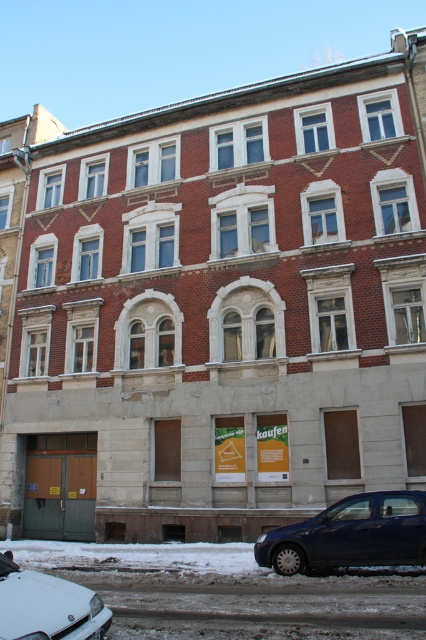
Based on the photo, you are a delivery person with a cart that is 1.2 meters wide. You need to park your cart between the dark blue metallic car at lower right and the white matte car at lower left. Can your cart fit in the space between them?

The dark blue metallic car at lower right might be wider than white matte car at lower left, so the space between them could be insufficient for the cart that is 1.2 meters wide. It is uncertain if the cart will fit without knowing the exact widths of both cars.

You are standing in front of the residential building and see a dark blue metallic car at lower right. What is the location of the point with coordinates (351,534) on the car?

The point with coordinates (351,534) is on the dark blue metallic car at lower right.

You are a delivery person approaching the building and need to park your vehicle. You see a dark blue metallic car at lower right and a white matte car at lower left. Which car is closer to you as you approach the building?

The dark blue metallic car at lower right is closer to you because it is further to the viewer than the white matte car at lower left, meaning it is positioned nearer in the scene.